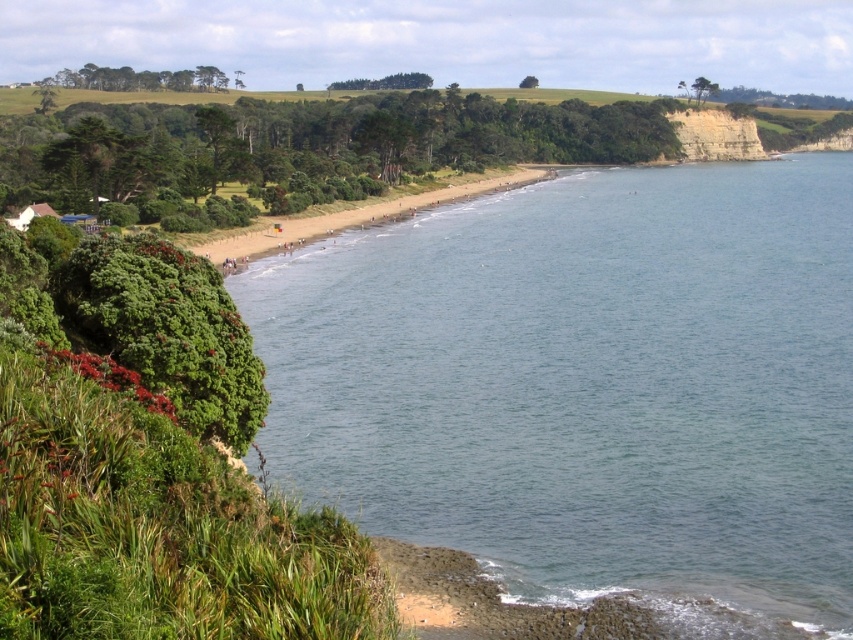
Is clear blue water at center positioned at the back of light beige sandstone cliff at upper right?

That is False.

Which is in front, point (543, 240) or point (738, 145)?

Positioned in front is point (543, 240).

Between point (492, 346) and point (717, 157), which one is positioned in front?

Point (492, 346)

The width and height of the screenshot is (853, 640). Find the location of `clear blue water at center`. clear blue water at center is located at coordinates (589, 387).